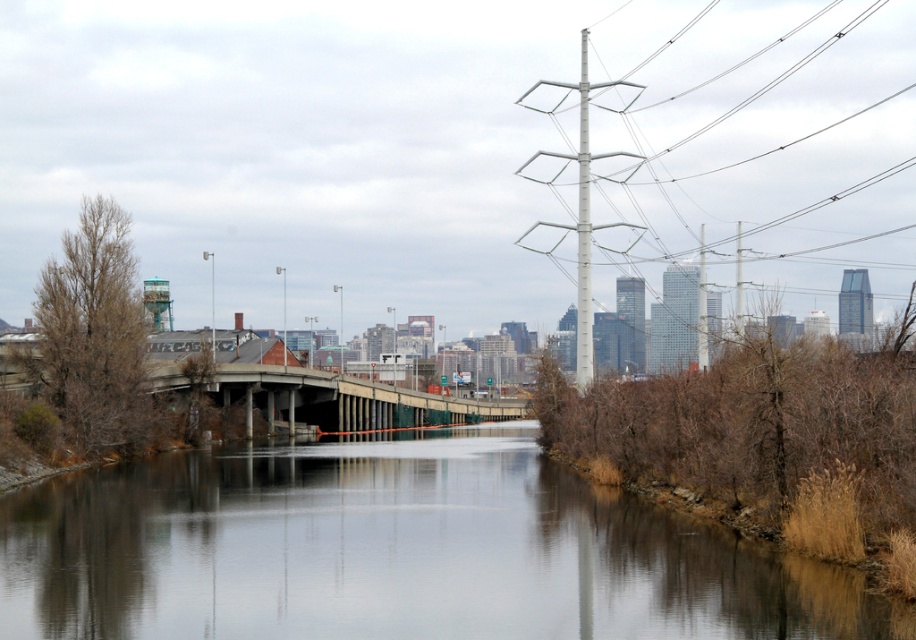
Question: Does smooth concrete river at center have a smaller size compared to concrete bridge at center?

Choices:
 (A) no
 (B) yes

Answer: (B)

Question: Is smooth concrete river at center smaller than concrete bridge at center?

Choices:
 (A) yes
 (B) no

Answer: (A)

Question: Which point appears farthest from the camera in this image?

Choices:
 (A) (893, 596)
 (B) (224, 365)

Answer: (B)

Question: Which point appears closest to the camera in this image?

Choices:
 (A) (760, 545)
 (B) (328, 412)

Answer: (A)

Question: In this image, where is smooth concrete river at center located relative to concrete bridge at center?

Choices:
 (A) left
 (B) right

Answer: (B)